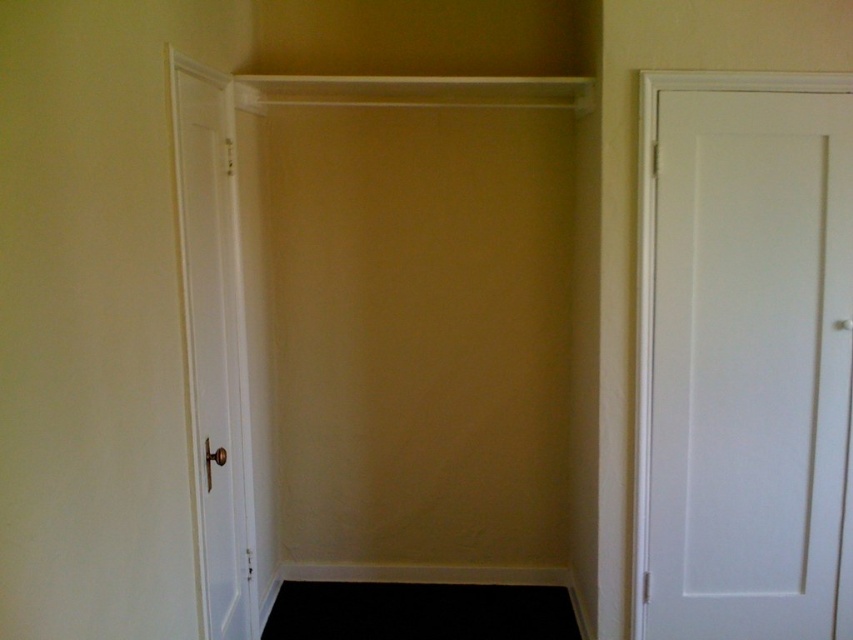
Question: Is white smooth door at right positioned before white smooth door at left?

Choices:
 (A) yes
 (B) no

Answer: (B)

Question: Is white smooth door at right in front of white smooth door at left?

Choices:
 (A) no
 (B) yes

Answer: (A)

Question: Among these points, which one is nearest to the camera?

Choices:
 (A) (227, 262)
 (B) (643, 163)

Answer: (B)

Question: Is white smooth door at right wider than white smooth door at left?

Choices:
 (A) yes
 (B) no

Answer: (A)